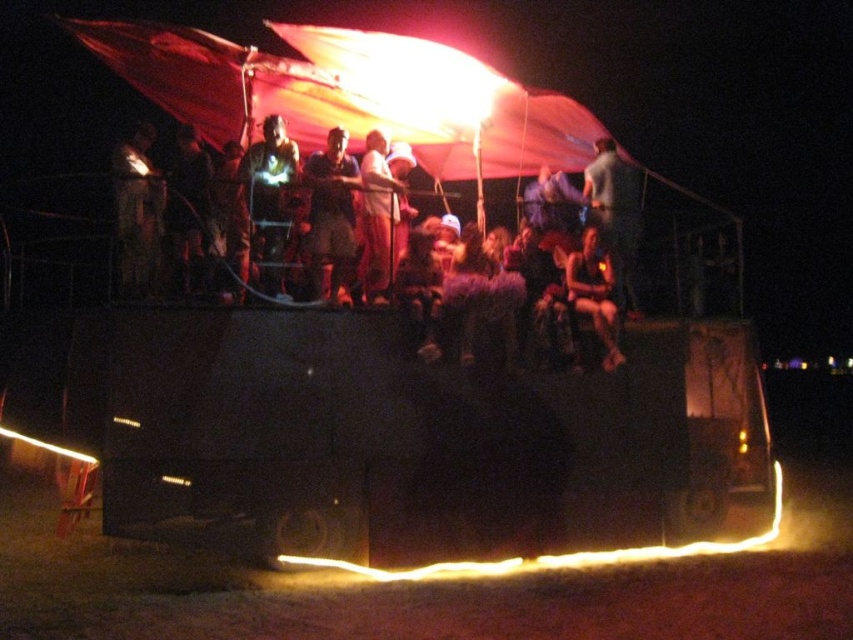
Question: Is matte black helmet at upper left bigger than white matte shirt at center?

Choices:
 (A) no
 (B) yes

Answer: (B)

Question: Among these objects, which one is farthest from the camera?

Choices:
 (A) white matte shirt at center
 (B) metallic silver helmet at center

Answer: (A)

Question: Which object appears closest to the camera in this image?

Choices:
 (A) matte black helmet at upper left
 (B) matte black t-shirt at center

Answer: (A)

Question: Which point is farther from the camera taking this photo?

Choices:
 (A) (613, 248)
 (B) (595, 292)
 (C) (146, 284)
 (D) (370, 234)

Answer: (A)

Question: In this image, where is white matte shirt at center located relative to dark gray fabric at center?

Choices:
 (A) left
 (B) right

Answer: (A)

Question: Does translucent fabric canopy at upper center appear under matte black t-shirt at center?

Choices:
 (A) no
 (B) yes

Answer: (A)